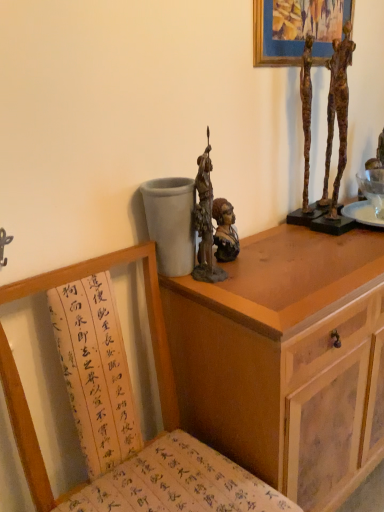
Locate an element on the screen. The height and width of the screenshot is (512, 384). bronze bust at center, the first person positioned from the left is located at coordinates (225, 231).

At what (x,y) coordinates should I click in order to perform the action: click on rusty metal sculpture at upper right, which ranks as the 1th person in right-to-left order. Please return your answer as a coordinate pair (x, y). Looking at the image, I should click on (337, 113).

Locate an element on the screen. The width and height of the screenshot is (384, 512). rusty bronze statue at center is located at coordinates (205, 222).

Are rusty bronze statue at center and wooden chair with calligraphy cushion at lower left far apart?

That's not correct — rusty bronze statue at center is a little close to wooden chair with calligraphy cushion at lower left.

How distant is rusty bronze statue at center from wooden chair with calligraphy cushion at lower left?

rusty bronze statue at center and wooden chair with calligraphy cushion at lower left are 13.31 inches apart.

Do you think rusty bronze statue at center is within wooden chair with calligraphy cushion at lower left, or outside of it?

rusty bronze statue at center is located beyond the bounds of wooden chair with calligraphy cushion at lower left.

Does rusty bronze statue at center come in front of wooden chair with calligraphy cushion at lower left?

No, it is not.

Locate an element on the screen. chair below the bronze bust at center, placed as the 2th person when sorted from right to left (from the image's perspective) is located at coordinates (150, 442).

Does bronze bust at center, the first person positioned from the left, have a greater width compared to wooden chair with calligraphy cushion at lower left?

In fact, bronze bust at center, the first person positioned from the left, might be narrower than wooden chair with calligraphy cushion at lower left.

From a real-world perspective, does bronze bust at center, placed as the 2th person when sorted from right to left, sit lower than wooden chair with calligraphy cushion at lower left?

Actually, bronze bust at center, placed as the 2th person when sorted from right to left, is physically above wooden chair with calligraphy cushion at lower left in the real world.

Who is shorter, bronze bust at center, the first person positioned from the left, or wooden cabinet at upper right?

bronze bust at center, the first person positioned from the left.

Is point (214, 238) positioned before point (328, 265)?

No, (214, 238) is further to viewer.

Does bronze bust at center, the first person positioned from the left, appear on the left side of wooden cabinet at upper right?

Yes, bronze bust at center, the first person positioned from the left, is to the left of wooden cabinet at upper right.

Is bronze bust at center, placed as the 2th person when sorted from right to left, thinner than wooden cabinet at upper right?

Indeed, bronze bust at center, placed as the 2th person when sorted from right to left, has a lesser width compared to wooden cabinet at upper right.

Is wooden chair with calligraphy cushion at lower left bigger than wooden cabinet at upper right?

Actually, wooden chair with calligraphy cushion at lower left might be smaller than wooden cabinet at upper right.

Between wooden chair with calligraphy cushion at lower left and wooden cabinet at upper right, which one appears on the right side from the viewer's perspective?

From the viewer's perspective, wooden cabinet at upper right appears more on the right side.

Is wooden chair with calligraphy cushion at lower left wider or thinner than wooden cabinet at upper right?

In the image, wooden chair with calligraphy cushion at lower left appears to be wider than wooden cabinet at upper right.

In terms of height, does wooden chair with calligraphy cushion at lower left look taller or shorter compared to wooden cabinet at upper right?

In the image, wooden chair with calligraphy cushion at lower left appears to be taller than wooden cabinet at upper right.

From the image's perspective, between bronze bust at center, the first person positioned from the left, and rusty bronze statue at center, who is located below?

bronze bust at center, the first person positioned from the left, from the image's perspective.

Is bronze bust at center, the first person positioned from the left, at the left side of rusty bronze statue at center?

No.

Looking at this image, does bronze bust at center, the first person positioned from the left, touch rusty bronze statue at center?

Yes, bronze bust at center, the first person positioned from the left, is with rusty bronze statue at center.

From the picture: Could you tell me if bronze bust at center, placed as the 2th person when sorted from right to left, is facing rusty bronze statue at center?

No, bronze bust at center, placed as the 2th person when sorted from right to left, is not turned towards rusty bronze statue at center.

Is wooden chair with calligraphy cushion at lower left surrounding rusty metal sculpture at upper right, which ranks as the 1th person in right-to-left order?

Actually, rusty metal sculpture at upper right, which ranks as the 1th person in right-to-left order, is outside wooden chair with calligraphy cushion at lower left.

Can you confirm if wooden chair with calligraphy cushion at lower left is wider than rusty metal sculpture at upper right, which ranks as the 1th person in right-to-left order?

Yes.

Considering the sizes of wooden chair with calligraphy cushion at lower left and rusty metal sculpture at upper right, which is counted as the 2th person, starting from the left, in the image, is wooden chair with calligraphy cushion at lower left bigger or smaller than rusty metal sculpture at upper right, which is counted as the 2th person, starting from the left,?

wooden chair with calligraphy cushion at lower left is bigger than rusty metal sculpture at upper right, which is counted as the 2th person, starting from the left.

Does wooden chair with calligraphy cushion at lower left touch rusty metal sculpture at upper right, which is counted as the 2th person, starting from the left?

No, wooden chair with calligraphy cushion at lower left is not in contact with rusty metal sculpture at upper right, which is counted as the 2th person, starting from the left.

Is rusty metal sculpture at upper right, which ranks as the 1th person in right-to-left order, shorter than wooden cabinet at upper right?

Indeed, rusty metal sculpture at upper right, which ranks as the 1th person in right-to-left order, has a lesser height compared to wooden cabinet at upper right.

Is rusty metal sculpture at upper right, which ranks as the 1th person in right-to-left order, situated inside wooden cabinet at upper right or outside?

rusty metal sculpture at upper right, which ranks as the 1th person in right-to-left order, exists outside the volume of wooden cabinet at upper right.

Measure the distance from rusty metal sculpture at upper right, which is counted as the 2th person, starting from the left, to wooden cabinet at upper right.

rusty metal sculpture at upper right, which is counted as the 2th person, starting from the left, is 23.49 inches away from wooden cabinet at upper right.

From a real-world perspective, does rusty metal sculpture at upper right, which ranks as the 1th person in right-to-left order, stand above wooden cabinet at upper right?

Yes, from a real-world perspective, rusty metal sculpture at upper right, which ranks as the 1th person in right-to-left order, is over wooden cabinet at upper right

Find the location of a particular element. sculpture that is above the wooden chair with calligraphy cushion at lower left (from the image's perspective) is located at coordinates (205, 222).

You are a GUI agent. You are given a task and a screenshot of the screen. Output one action in this format:
    pyautogui.click(x=<x>, y=<y>)
    Task: Click on the chair that appears below the bronze bust at center, the first person positioned from the left (from a real-world perspective)
    The height and width of the screenshot is (512, 384).
    Given the screenshot: What is the action you would take?
    pyautogui.click(x=150, y=442)

Based on the photo, estimate the real-world distances between objects in this image. Which object is further from wooden cabinet at upper right, rusty metal sculpture at upper right, which is counted as the 2th person, starting from the left, or bronze bust at center, placed as the 2th person when sorted from right to left?

rusty metal sculpture at upper right, which is counted as the 2th person, starting from the left.

Based on their spatial positions, is rusty metal sculpture at upper right, which is counted as the 2th person, starting from the left, or wooden chair with calligraphy cushion at lower left closer to bronze bust at center, the first person positioned from the left?

Among the two, wooden chair with calligraphy cushion at lower left is located nearer to bronze bust at center, the first person positioned from the left.

Looking at the image, which one is located closer to bronze bust at center, the first person positioned from the left, wooden cabinet at upper right or rusty metal sculpture at upper right, which ranks as the 1th person in right-to-left order?

Among the two, wooden cabinet at upper right is located nearer to bronze bust at center, the first person positioned from the left.

Based on their spatial positions, is rusty bronze statue at center or wooden cabinet at upper right further from bronze bust at center, placed as the 2th person when sorted from right to left?

The object further to bronze bust at center, placed as the 2th person when sorted from right to left, is wooden cabinet at upper right.

Based on their spatial positions, is wooden cabinet at upper right or rusty bronze statue at center further from bronze bust at center, the first person positioned from the left?

wooden cabinet at upper right.

Considering their positions, is bronze bust at center, placed as the 2th person when sorted from right to left, positioned closer to rusty bronze statue at center than rusty metal sculpture at upper right, which ranks as the 1th person in right-to-left order?

bronze bust at center, placed as the 2th person when sorted from right to left, is positioned closer to the anchor rusty bronze statue at center.

Considering their positions, is rusty metal sculpture at upper right, which is counted as the 2th person, starting from the left, positioned further to wooden cabinet at upper right than rusty bronze statue at center?

rusty metal sculpture at upper right, which is counted as the 2th person, starting from the left, is positioned further to the anchor wooden cabinet at upper right.

Looking at this image, looking at the image, which one is located further to wooden cabinet at upper right, wooden chair with calligraphy cushion at lower left or rusty bronze statue at center?

Among the two, rusty bronze statue at center is located further to wooden cabinet at upper right.

Identify the location of sculpture located between wooden chair with calligraphy cushion at lower left and bronze bust at center, the first person positioned from the left, in the depth direction. The width and height of the screenshot is (384, 512). (205, 222).

Identify the location of person between rusty metal sculpture at upper right, which ranks as the 1th person in right-to-left order, and wooden chair with calligraphy cushion at lower left, in the vertical direction. The height and width of the screenshot is (512, 384). (225, 231).

This screenshot has height=512, width=384. Find the location of `person between rusty bronze statue at center and rusty metal sculpture at upper right, which ranks as the 1th person in right-to-left order, from left to right`. person between rusty bronze statue at center and rusty metal sculpture at upper right, which ranks as the 1th person in right-to-left order, from left to right is located at coordinates (225, 231).

Identify the location of person between rusty metal sculpture at upper right, which is counted as the 2th person, starting from the left, and wooden cabinet at upper right, in the vertical direction. This screenshot has height=512, width=384. (225, 231).